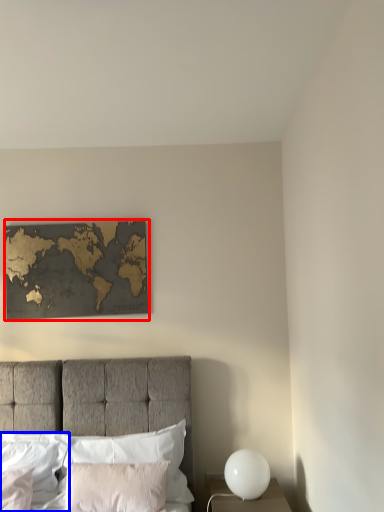
Question: Among these objects, which one is farthest to the camera, picture frame (highlighted by a red box) or pillow (highlighted by a blue box)?

Choices:
 (A) picture frame
 (B) pillow

Answer: (A)